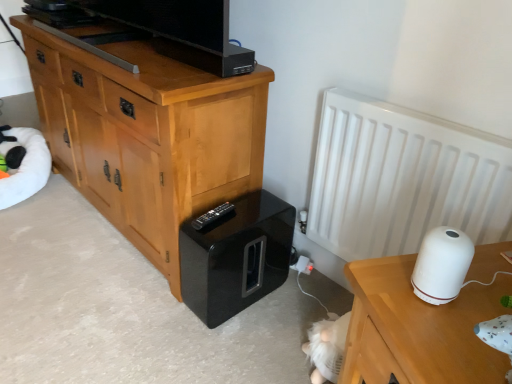
This screenshot has height=384, width=512. Identify the location of vacant space to the left of glossy black speaker at lower center. (152, 306).